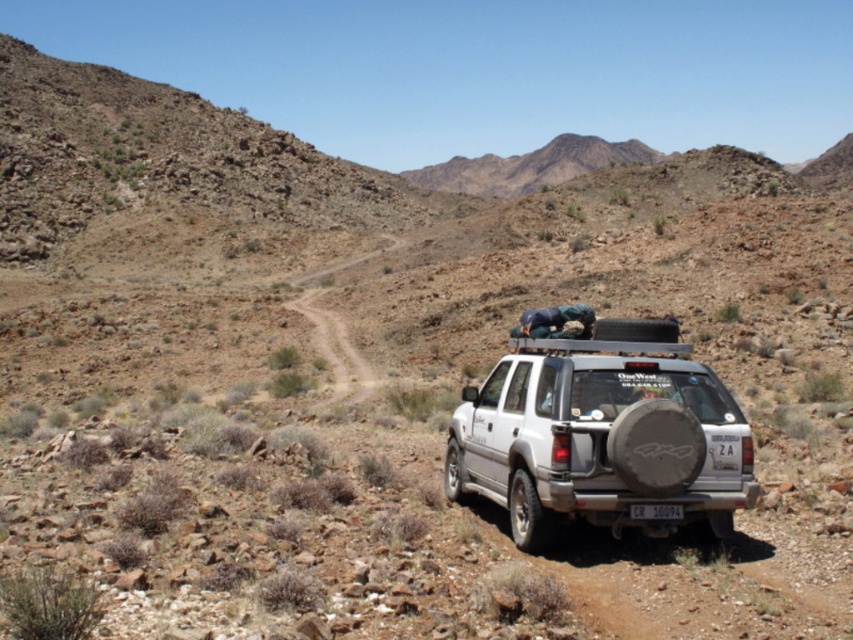
In the scene shown: Does silver metallic suv at center appear on the left side of white plastic license plate at rear?

Indeed, silver metallic suv at center is positioned on the left side of white plastic license plate at rear.

Does silver metallic suv at center appear under white plastic license plate at rear?

No, silver metallic suv at center is not below white plastic license plate at rear.

Describe the element at coordinates (601, 435) in the screenshot. I see `silver metallic suv at center` at that location.

Locate an element on the screen. Image resolution: width=853 pixels, height=640 pixels. silver metallic suv at center is located at coordinates (601, 435).